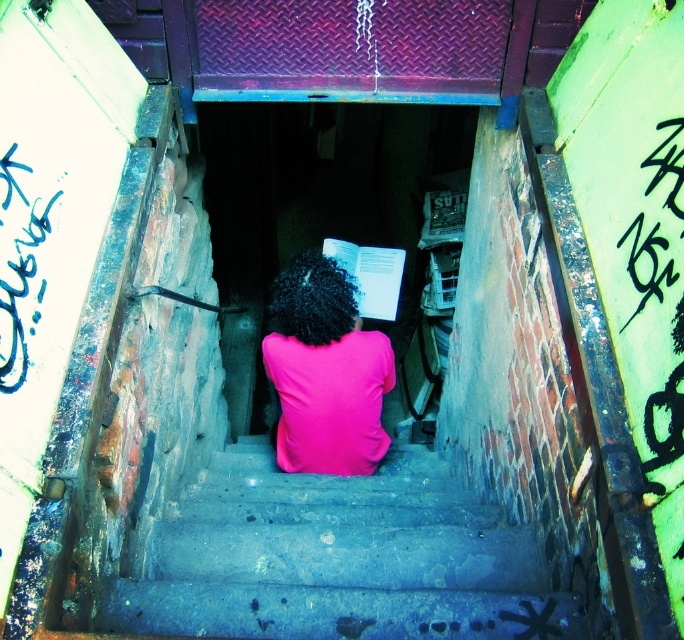
Is smooth concrete stairs at center closer to camera compared to pink matte shirt at center?

Yes, smooth concrete stairs at center is closer to the viewer.

In order to click on smooth concrete stairs at center in this screenshot , I will do `click(339, 557)`.